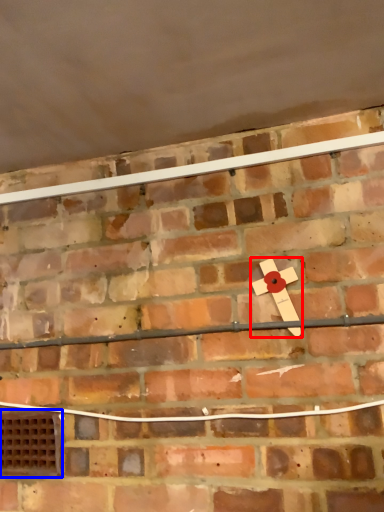
Question: Among these objects, which one is nearest to the camera, magnet (highlighted by a red box) or window (highlighted by a blue box)?

Choices:
 (A) magnet
 (B) window

Answer: (A)